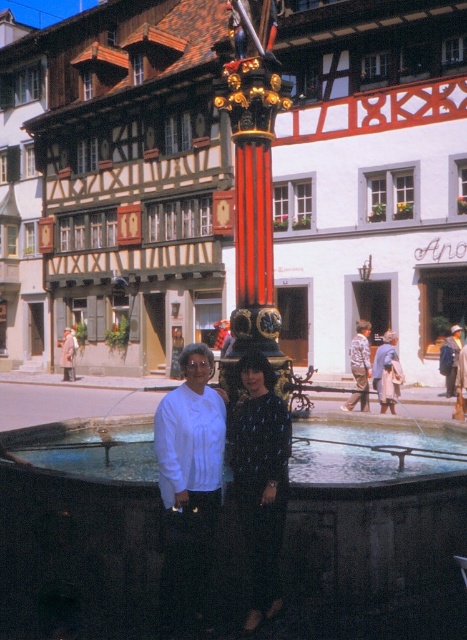
You are a photographer trying to capture both the dark blue textured dress at center and the blue denim jacket at lower right in the same frame. Based on their sizes, which one might appear smaller in the photo?

The dark blue textured dress at center is thinner than the blue denim jacket at lower right, so it will appear smaller in the photo.

You are a photographer trying to capture the fountain and the two women in the scene. You notice the dark blue textured dress at center and the blue denim jacket at lower right. Which of these two items is positioned more to the left side of the image?

The dark blue textured dress at center is positioned to the left of the blue denim jacket at lower right, so the dark blue textured dress at center is more to the left.

You are standing in front of the fountain in the European town scene. There are two points marked in the image. Which of the two points, point (316, 589) or point (243, 461), is closer to you?

Point (316, 589) is closer to the viewer than point (243, 461).